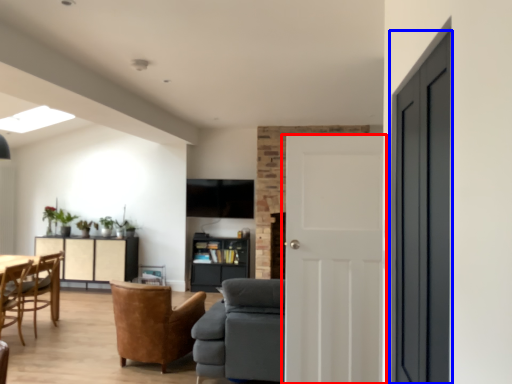
Question: Which object is further to the camera taking this photo, door (highlighted by a red box) or door (highlighted by a blue box)?

Choices:
 (A) door
 (B) door

Answer: (A)